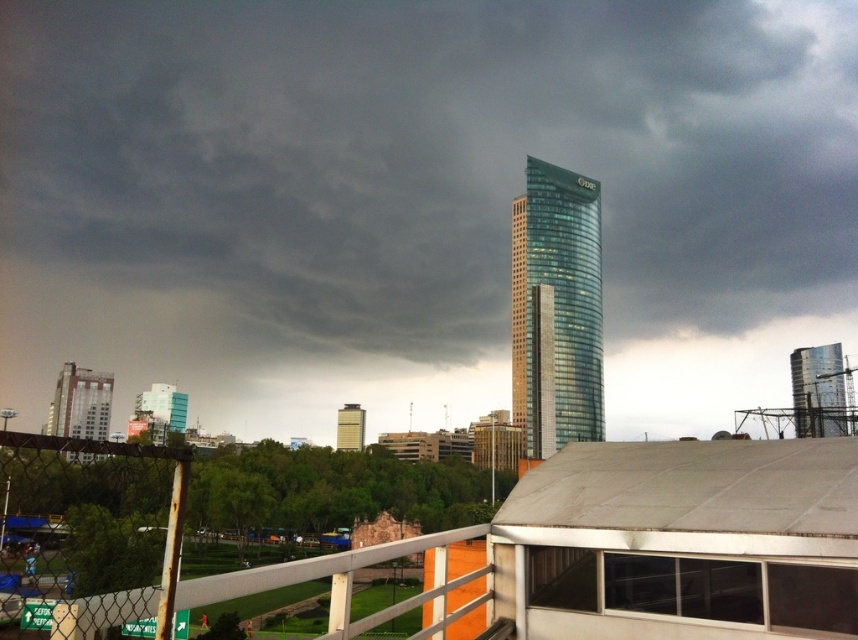
Consider the image. You are an architect analyzing the urban skyline. Given the scene described, which of the two buildings, the glassy teal skyscraper at center or the blue glass building at lower left, would require more materials for construction based on their size?

The glassy teal skyscraper at center is bigger than the blue glass building at lower left, so it would require more materials for construction based on their size.

You are an architect analyzing the urban layout. Based on the scene, which structure would appear closer to you when comparing the dark gray glass skyscraper at center and the glassy reflective tower at upper right?

The dark gray glass skyscraper at center appears closer to you because it is positioned further to the viewer compared to the glassy reflective tower at upper right.

You are standing at the viewpoint of the image and want to know how far the point at coordinates (x=582, y=388) is from you. Can you determine the distance?

The point at coordinates (x=582, y=388) is 187.66 meters away from you.